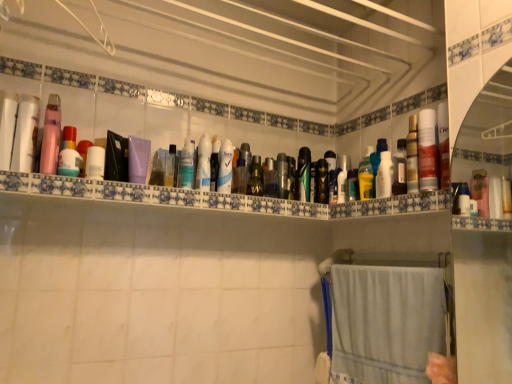
Question: Looking at the image, does green matte toothbrush at center, which ranks as the eighth toiletry in right-to-left order, seem bigger or smaller compared to purple matte bottle at center, acting as the 5th toiletry starting from the left?

Choices:
 (A) big
 (B) small

Answer: (B)

Question: From the image's perspective, is green matte toothbrush at center, acting as the 15th toiletry starting from the left, above or below purple matte bottle at center, placed as the 18th toiletry when sorted from right to left?

Choices:
 (A) below
 (B) above

Answer: (A)

Question: Which of these objects is positioned farthest from the clear plastic bottle at upper center, the 21th toiletry in the left-to-right sequence?

Choices:
 (A) translucent plastic bottle at center, placed as the 20th toiletry when sorted from right to left
 (B) translucent plastic bottles at upper center
 (C) transparent plastic bottle at center, which is the sixth toiletry from left to right
 (D) clear plastic spray can at center, which appears as the 13th toiletry when viewed from the right
 (E) metallic silver can at center, the twelfth toiletry positioned from the left

Answer: (A)

Question: Estimate the real-world distances between objects in this image. Which object is closer to the white glossy lotion at center, marked as the twentieth toiletry in a left-to-right arrangement?

Choices:
 (A) purple matte bottle at center, acting as the 5th toiletry starting from the left
 (B) white matte bottle at upper left, which is counted as the 4th toiletry, starting from the left
 (C) white glossy lotion at center, which is counted as the eighteenth toiletry, starting from the left
 (D) black matte hairbrush at center, arranged as the seventh toiletry when viewed from the right
 (E) transparent plastic bottle at center, the 17th toiletry in the right-to-left sequence

Answer: (C)